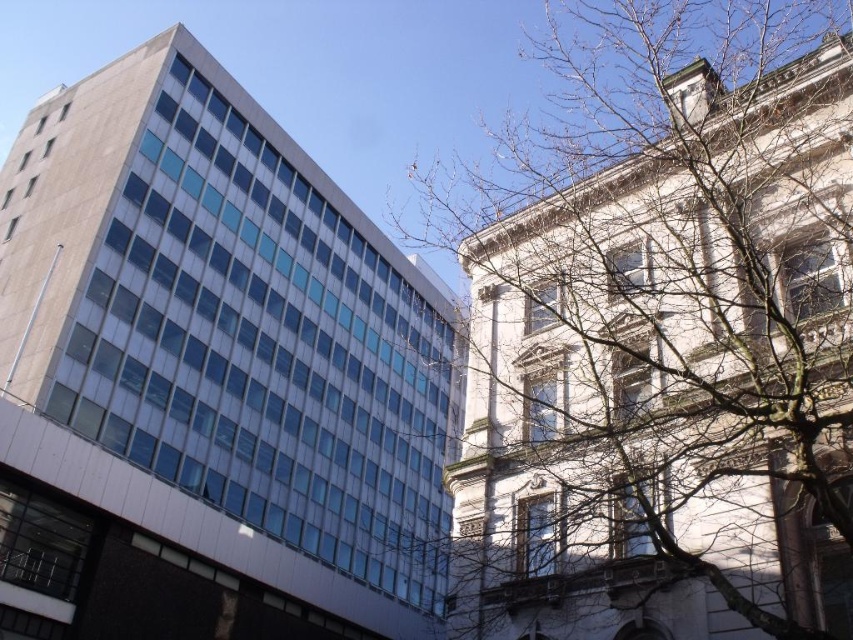
Is point (595, 454) positioned before point (360, 429)?

Yes, it is.

Does point (640, 328) come farther from viewer compared to point (96, 76)?

No, (640, 328) is closer to viewer.

Find the location of a particular element. bare branches at upper right is located at coordinates (660, 332).